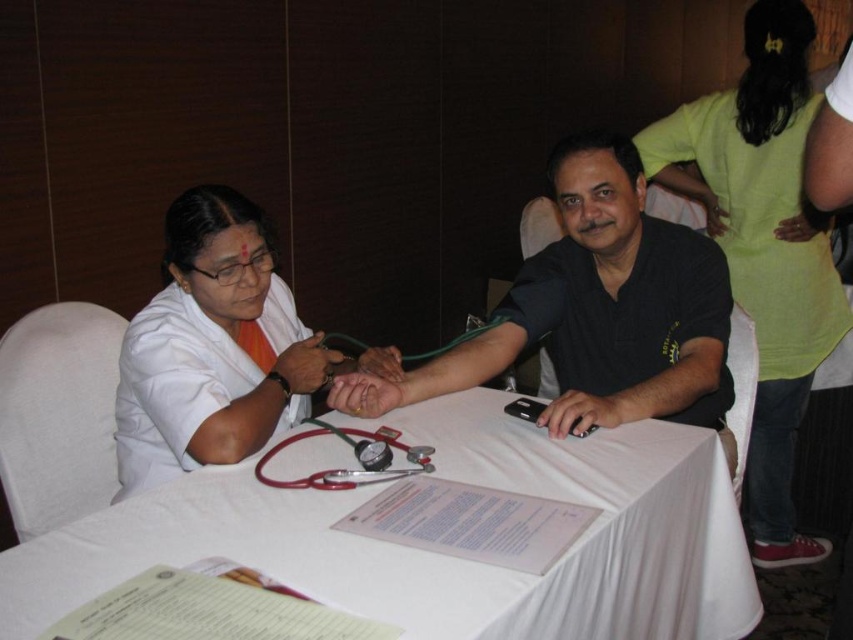
You are a medical student observing a blood pressure measurement. You need to determine which object is higher in the image between the black matte shirt at center and the red rubber stethoscope at center. Based on your observation, which one is taller?

The black matte shirt at center is taller than the red rubber stethoscope at center.